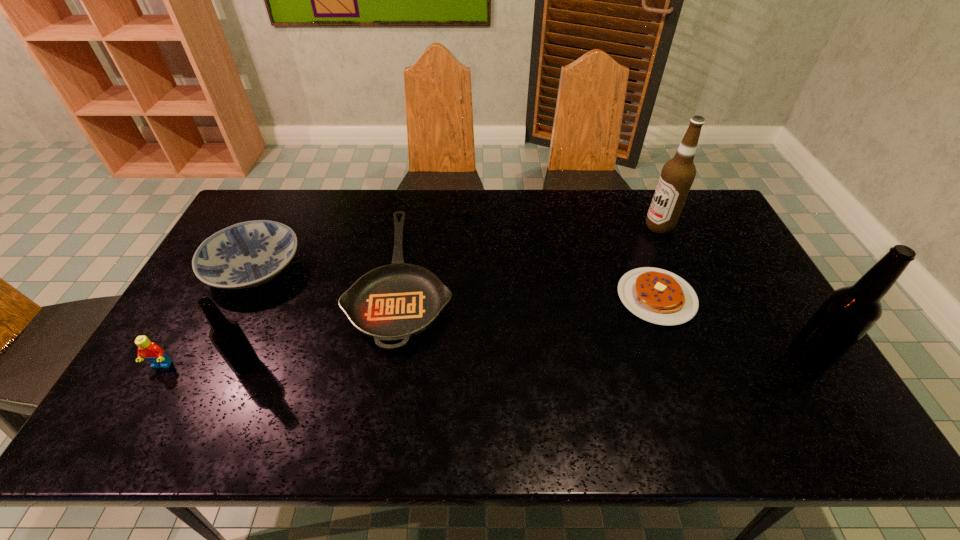
In the image, there is a desktop. At what (x,y) coordinates should I click in order to perform the action: click on vacant space at the near left corner. Please return your answer as a coordinate pair (x, y). This screenshot has height=540, width=960. Looking at the image, I should click on (195, 369).

Where is `vacant position at the near right corner of the desktop`? The width and height of the screenshot is (960, 540). vacant position at the near right corner of the desktop is located at coordinates (790, 396).

Locate an element on the screen. The width and height of the screenshot is (960, 540). empty space that is in between the third shortest object and the third tallest object is located at coordinates (251, 317).

Locate an element on the screen. The image size is (960, 540). free space between the taller beer bottle and the shorter beer bottle is located at coordinates (527, 362).

At what (x,y) coordinates should I click in order to perform the action: click on free space between the alcohol and the left beer bottle. Please return your answer as a coordinate pair (x, y). The width and height of the screenshot is (960, 540). Looking at the image, I should click on (453, 296).

Locate an element on the screen. vacant area that lies between the rightmost object and the pancake is located at coordinates pyautogui.click(x=732, y=328).

What are the coordinates of `vacant space that is in between the fourth shortest object and the left beer bottle` in the screenshot? It's located at (204, 366).

Locate an element on the screen. blank region between the frying pan and the fourth shortest object is located at coordinates (282, 323).

The image size is (960, 540). Identify the location of free space that is in between the alcohol and the pancake. (658, 262).

Locate an element on the screen. The image size is (960, 540). free space between the plate and the frying pan is located at coordinates (328, 274).